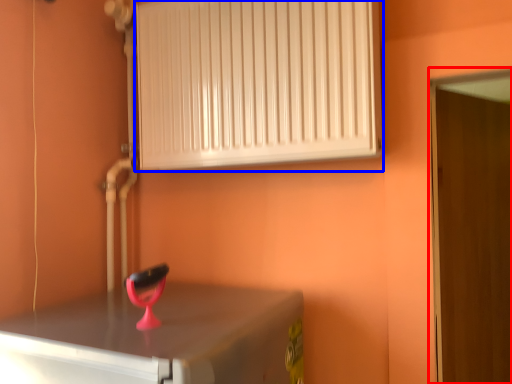
Question: Which object appears closest to the camera in this image, door (highlighted by a red box) or radiator (highlighted by a blue box)?

Choices:
 (A) door
 (B) radiator

Answer: (B)